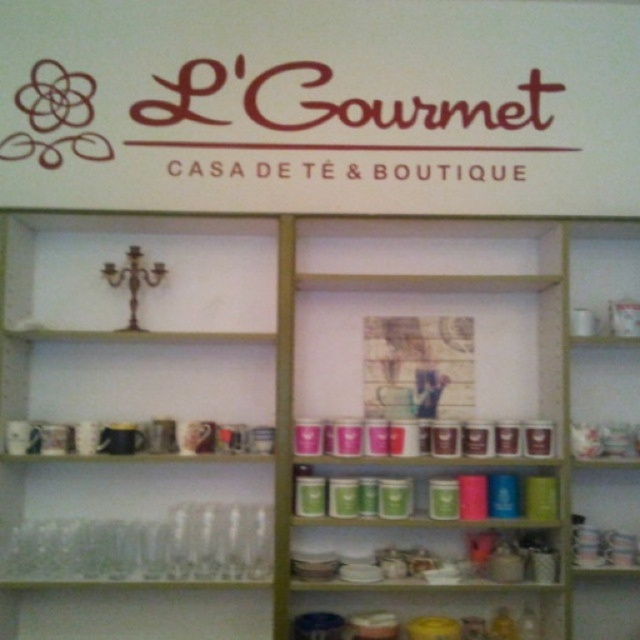
Question: Can you confirm if matte ceramic jars at lower center is wider than matte glass jars at center?

Choices:
 (A) yes
 (B) no

Answer: (A)

Question: Which of the following is the closest to the observer?

Choices:
 (A) matte glass jars at center
 (B) matte ceramic jars at lower center
 (C) matte ceramic bowls at center

Answer: (B)

Question: Which point appears closest to the camera in this image?

Choices:
 (A) (547, 609)
 (B) (488, 564)
 (C) (525, 468)

Answer: (B)

Question: Does matte ceramic jars at lower center appear on the left side of matte glass jars at center?

Choices:
 (A) yes
 (B) no

Answer: (A)

Question: Is matte ceramic jars at lower center below matte glass jars at center?

Choices:
 (A) yes
 (B) no

Answer: (A)

Question: Which of the following is the closest to the observer?

Choices:
 (A) (548, 534)
 (B) (358, 611)
 (C) (429, 476)

Answer: (A)